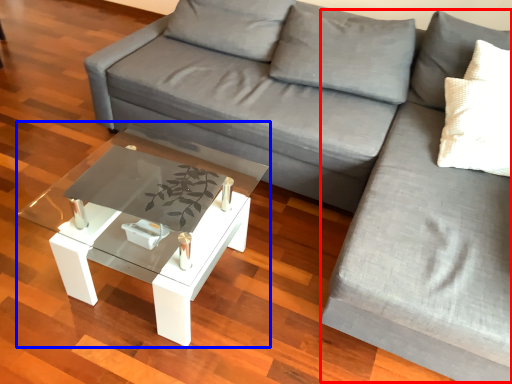
Question: Which of the following is the closest to the observer, couch (highlighted by a red box) or coffee table (highlighted by a blue box)?

Choices:
 (A) couch
 (B) coffee table

Answer: (A)